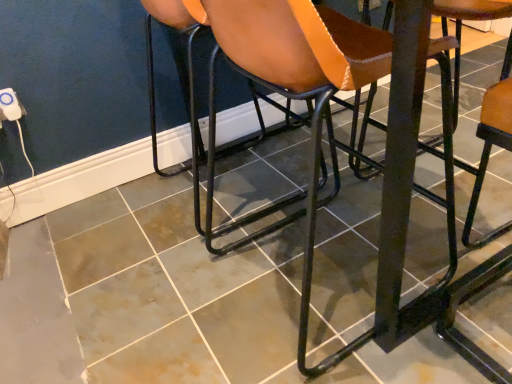
Identify the location of free space to the left of metallic black stool at right, which is the third chair in left-to-right order. The height and width of the screenshot is (384, 512). (402, 344).